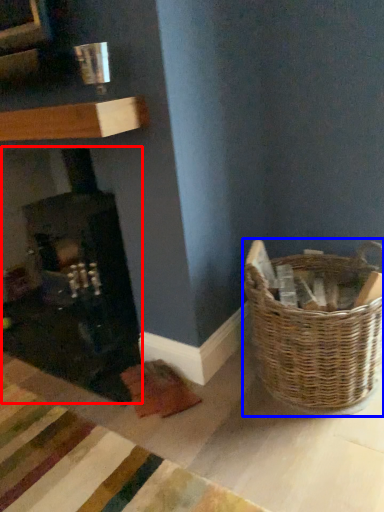
Question: Which of the following is the closest to the observer, fireplace (highlighted by a red box) or picnic basket (highlighted by a blue box)?

Choices:
 (A) fireplace
 (B) picnic basket

Answer: (B)